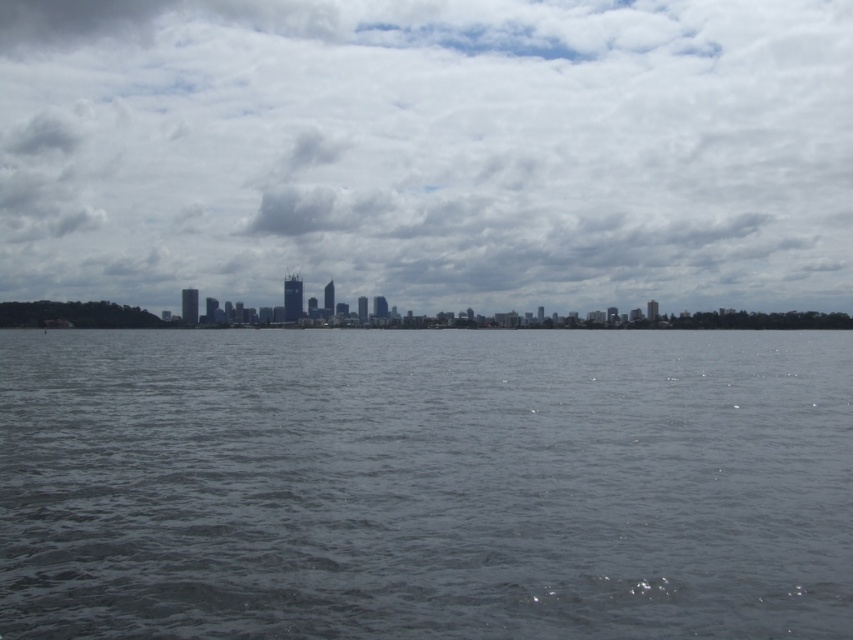
Does gray water at center appear on the right side of cloudy sky at center?

Yes, gray water at center is to the right of cloudy sky at center.

Between point (543, 577) and point (428, 275), which one is positioned in front?

Point (543, 577)

Image resolution: width=853 pixels, height=640 pixels. What are the coordinates of `gray water at center` in the screenshot? It's located at (424, 484).